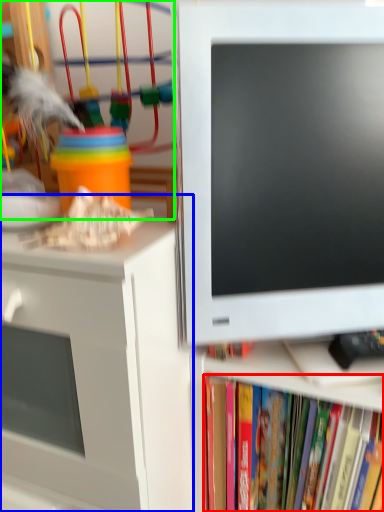
Question: Estimate the real-world distances between objects in this image. Which object is closer to book (highlighted by a red box), desk (highlighted by a blue box) or toy (highlighted by a green box)?

Choices:
 (A) desk
 (B) toy

Answer: (A)